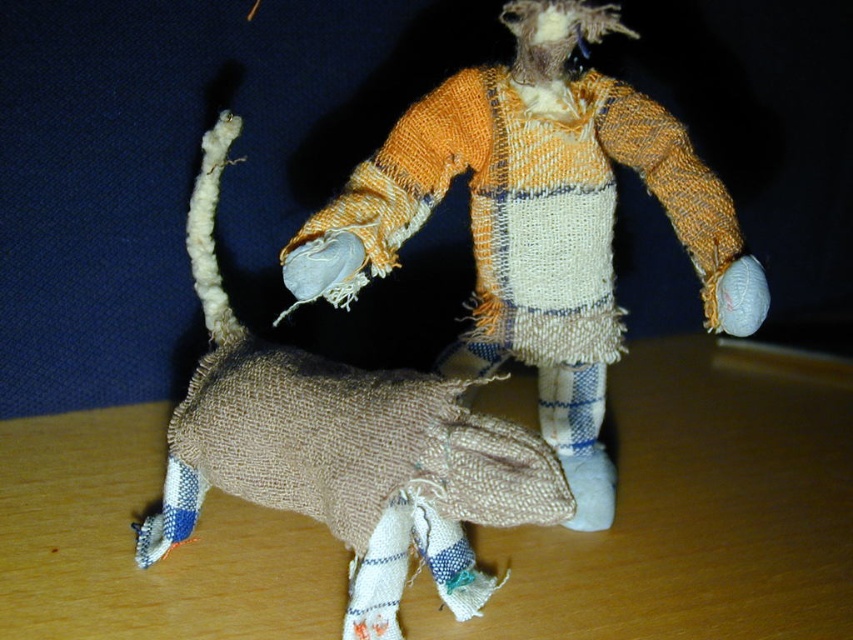
Between textured burlap scarecrow at center and burlap dog at center, which one has more height?

Standing taller between the two is textured burlap scarecrow at center.

Does textured burlap scarecrow at center have a greater width compared to burlap dog at center?

Correct, the width of textured burlap scarecrow at center exceeds that of burlap dog at center.

This screenshot has width=853, height=640. Identify the location of textured burlap scarecrow at center. (537, 221).

This screenshot has width=853, height=640. In order to click on textured burlap scarecrow at center in this screenshot , I will do `click(537, 221)`.

Between wooden table at center and textured burlap scarecrow at center, which one appears on the left side from the viewer's perspective?

wooden table at center

Which is above, wooden table at center or textured burlap scarecrow at center?

textured burlap scarecrow at center is above.

Between point (49, 547) and point (525, 68), which one is positioned in front?

Point (525, 68) is more forward.

Locate an element on the screen. The image size is (853, 640). wooden table at center is located at coordinates (688, 518).

Can you confirm if wooden table at center is taller than burlap dog at center?

No.

Consider the image. Which of these two, wooden table at center or burlap dog at center, stands shorter?

Standing shorter between the two is wooden table at center.

Where is `wooden table at center`? This screenshot has width=853, height=640. wooden table at center is located at coordinates (688, 518).